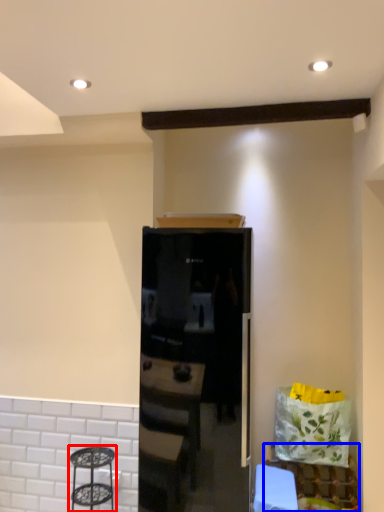
Question: Among these objects, which one is farthest to the camera, step stool (highlighted by a red box) or furniture (highlighted by a blue box)?

Choices:
 (A) step stool
 (B) furniture

Answer: (B)